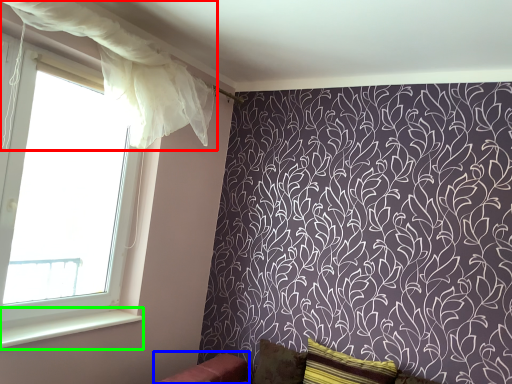
Question: Considering the real-world distances, which object is farthest from curtain (highlighted by a red box)? furniture (highlighted by a blue box) or window sill (highlighted by a green box)?

Choices:
 (A) furniture
 (B) window sill

Answer: (A)